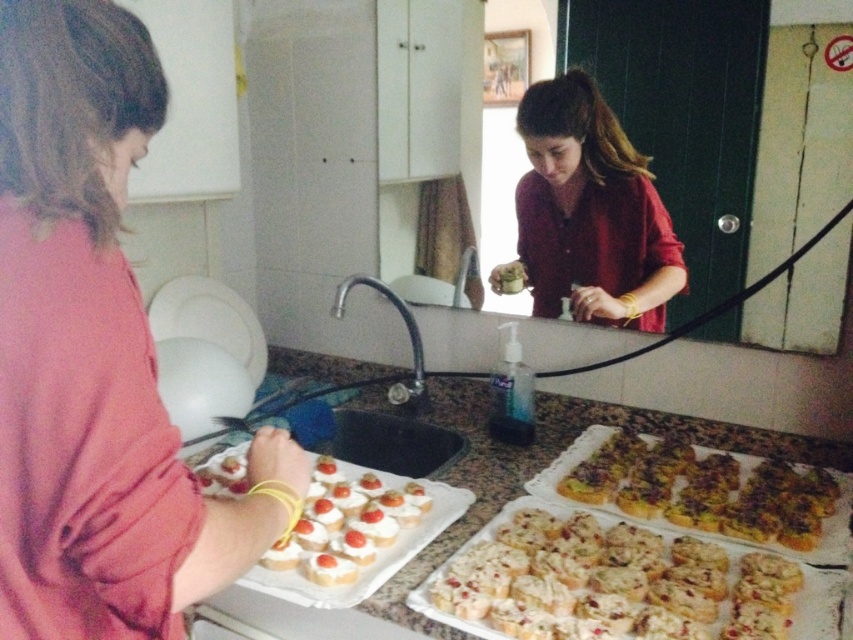
You are a chef who needs to place a new ingredient on the closest object to the mirror. Which object should you choose between the white marble tray at lower left and the crusty golden bread at lower right?

The white marble tray at lower left is closer to the mirror because it is in front of the crusty golden bread at lower right.

Based on the coordinates provided, where is the white marble tray at lower left positioned in the image?

The white marble tray at lower left is positioned at the coordinates point (550,460).

You are a baker who needs to place both the white crumbly at center and the crusty golden bread at lower right on a shelf. The shelf can only hold items that are no taller than 10 centimeters. Based on the scene description, can both items be placed on the shelf?

The white crumbly at center has a lesser height compared to crusty golden bread at lower right. Since the shelf requires items to be no taller than 10 centimeters, we need to know the exact height of the taller item. However, the description only states that the white crumbly is shorter. If the crusty golden bread at lower right exceeds 10 centimeters, then it cannot be placed. Without specific measurements, we cannot confirm both fit.